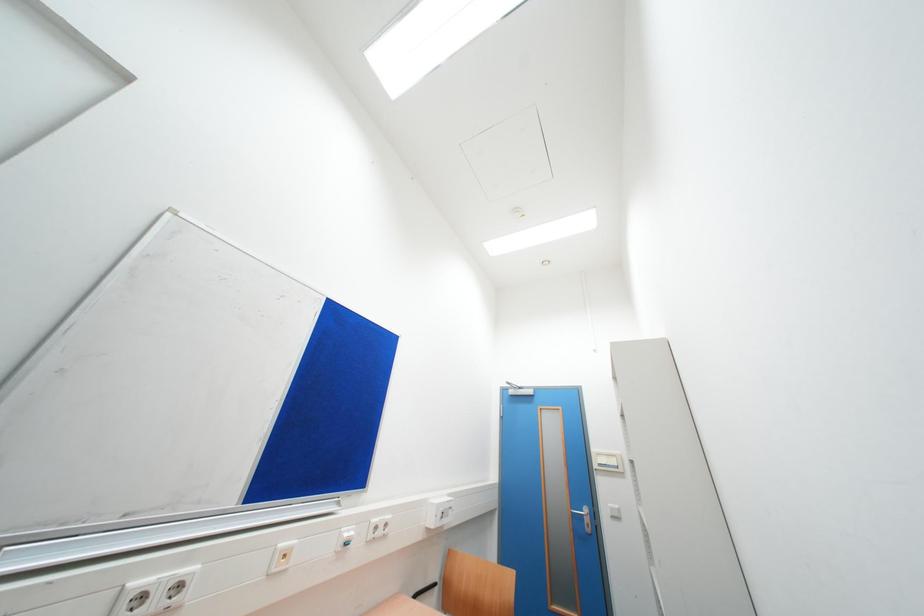
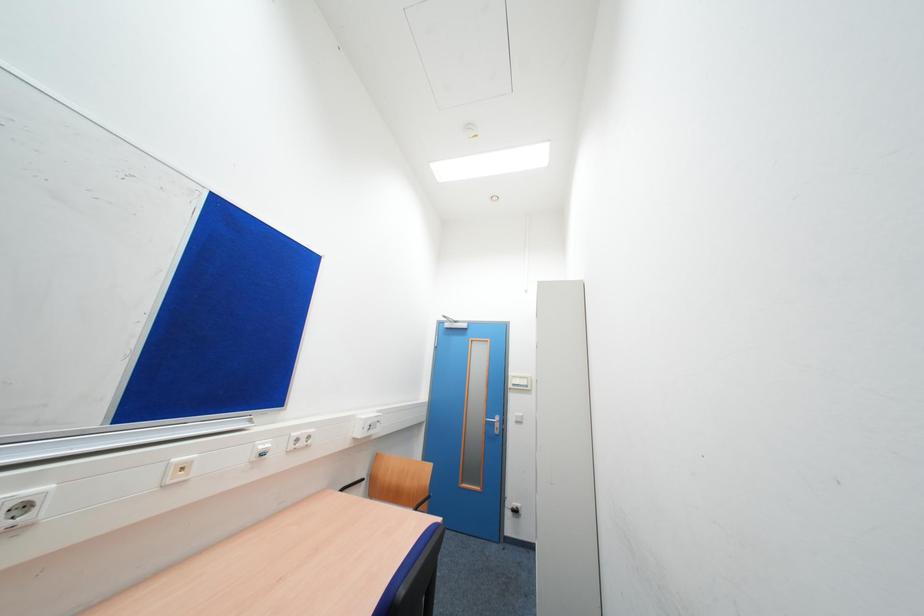
Question: How did the camera likely rotate?

Choices:
 (A) Left
 (B) Right
 (C) Up
 (D) Down

Answer: (D)